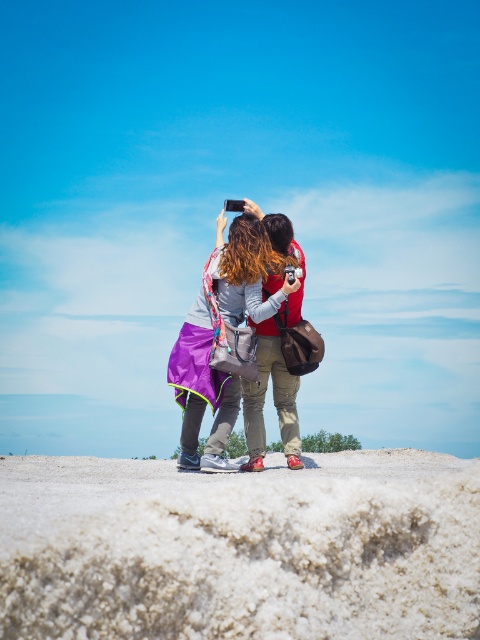
Question: Which point appears closest to the camera in this image?

Choices:
 (A) coord(292,262)
 (B) coord(300,248)

Answer: (A)

Question: Is purple fabric jacket at center positioned at the back of matte red shoes at center?

Choices:
 (A) no
 (B) yes

Answer: (A)

Question: Can you confirm if purple fabric jacket at center is positioned above matte red shoes at center?

Choices:
 (A) yes
 (B) no

Answer: (A)

Question: Is purple fabric jacket at center smaller than matte red shoes at center?

Choices:
 (A) yes
 (B) no

Answer: (B)